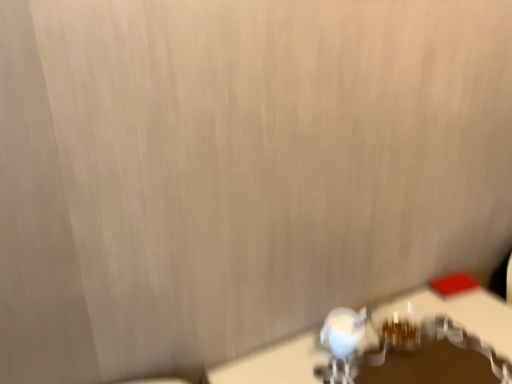
The image size is (512, 384). I want to click on spots to the right of white glossy faucet at lower center, so 424,358.